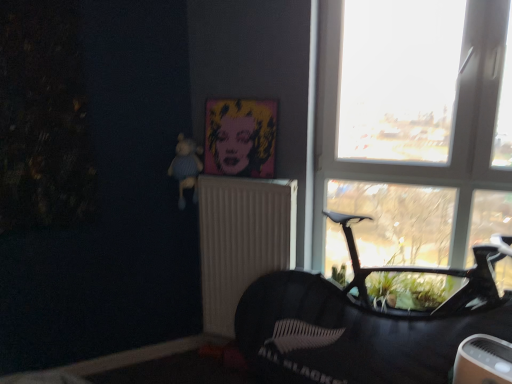
Question: Considering the relative positions of pop art canvas at upper center and transparent glass window at upper right in the image provided, is pop art canvas at upper center to the left of transparent glass window at upper right from the viewer's perspective?

Choices:
 (A) yes
 (B) no

Answer: (A)

Question: Can you confirm if pop art canvas at upper center is shorter than transparent glass window at upper right?

Choices:
 (A) yes
 (B) no

Answer: (A)

Question: Is pop art canvas at upper center positioned far away from transparent glass window at upper right?

Choices:
 (A) no
 (B) yes

Answer: (A)

Question: Considering the relative sizes of pop art canvas at upper center and transparent glass window at upper right in the image provided, is pop art canvas at upper center bigger than transparent glass window at upper right?

Choices:
 (A) yes
 (B) no

Answer: (B)

Question: From the image's perspective, does pop art canvas at upper center appear higher than transparent glass window at upper right?

Choices:
 (A) yes
 (B) no

Answer: (A)

Question: From the image's perspective, is blue knitted bear at upper left positioned above or below pop art canvas at upper center?

Choices:
 (A) above
 (B) below

Answer: (B)

Question: Which is correct: blue knitted bear at upper left is inside pop art canvas at upper center, or outside of it?

Choices:
 (A) inside
 (B) outside

Answer: (B)

Question: From a real-world perspective, is blue knitted bear at upper left positioned above or below pop art canvas at upper center?

Choices:
 (A) below
 (B) above

Answer: (A)

Question: Looking at their shapes, would you say blue knitted bear at upper left is wider or thinner than pop art canvas at upper center?

Choices:
 (A) thin
 (B) wide

Answer: (B)

Question: Does point [x=245, y=283] appear closer or farther from the camera than point [x=181, y=162]?

Choices:
 (A) closer
 (B) farther

Answer: (B)

Question: Is white textured radiator at center taller or shorter than blue knitted bear at upper left?

Choices:
 (A) tall
 (B) short

Answer: (A)

Question: From a real-world perspective, is white textured radiator at center positioned above or below blue knitted bear at upper left?

Choices:
 (A) above
 (B) below

Answer: (B)

Question: Considering their positions, is white textured radiator at center located in front of or behind blue knitted bear at upper left?

Choices:
 (A) behind
 (B) front

Answer: (B)

Question: In the image, is pop art canvas at upper center on the left side or the right side of blue knitted bear at upper left?

Choices:
 (A) right
 (B) left

Answer: (A)

Question: In terms of width, does pop art canvas at upper center look wider or thinner when compared to blue knitted bear at upper left?

Choices:
 (A) thin
 (B) wide

Answer: (A)